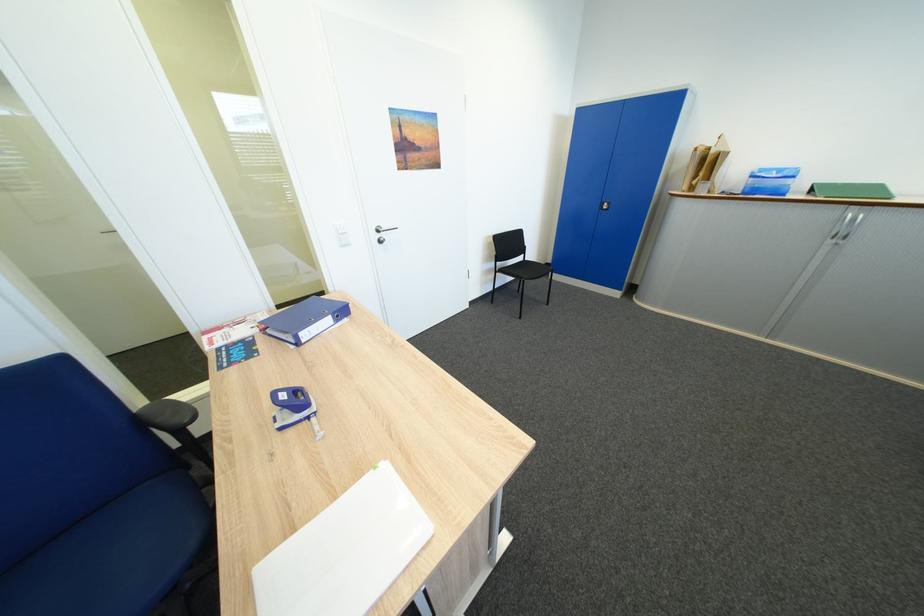
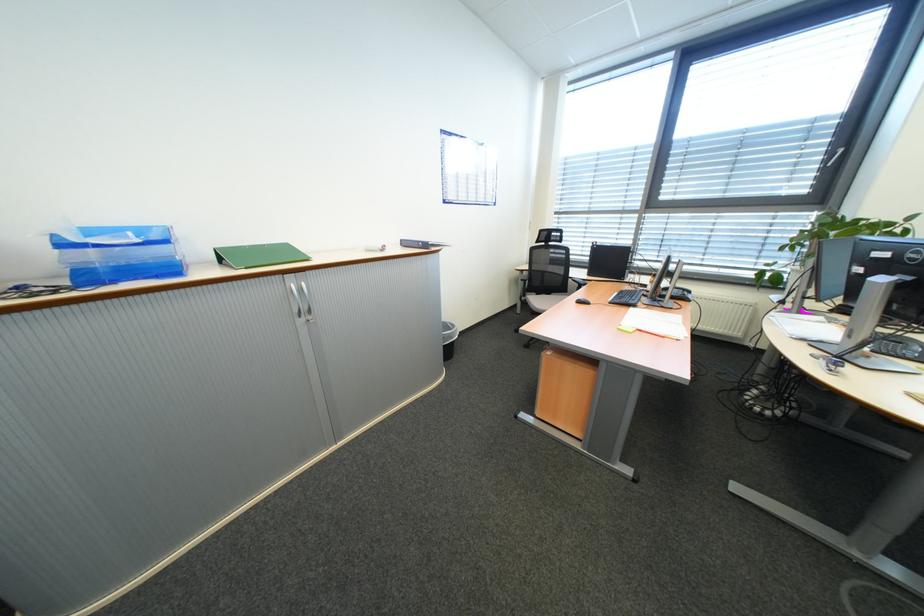
Question: I am providing you with two images of the same scene from different viewpoints. After the viewpoint changes to image2, which objects are now occluded?

Choices:
 (A) blue plastic tray
 (B) chair sitting surface
 (C) black trash can
 (D) none of these

Answer: (D)